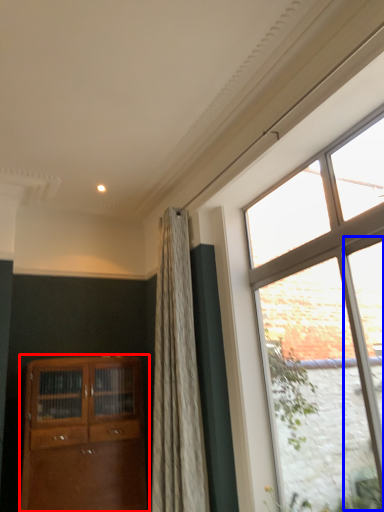
Question: Which point is closer to the camera, cabinetry (highlighted by a red box) or glass door (highlighted by a blue box)?

Choices:
 (A) cabinetry
 (B) glass door

Answer: (B)